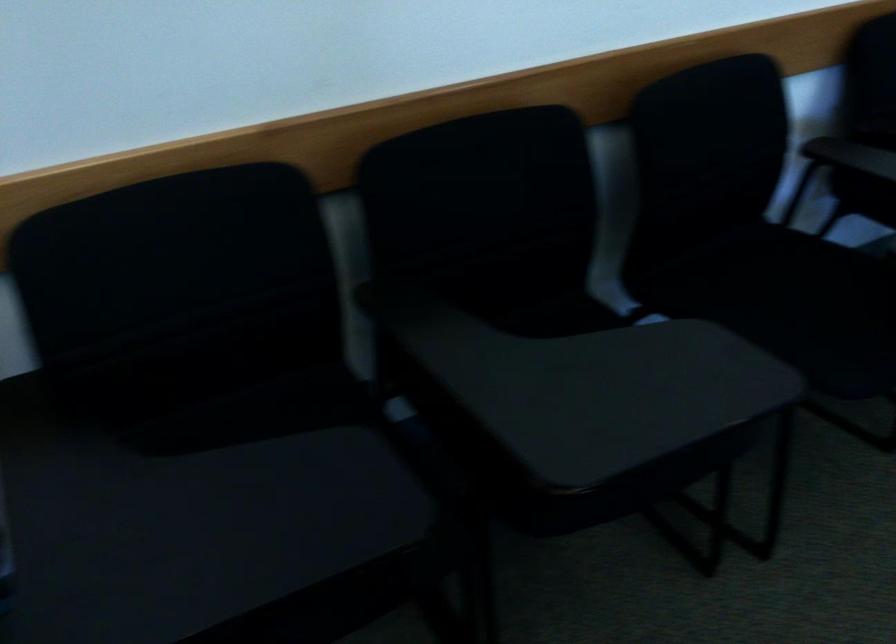
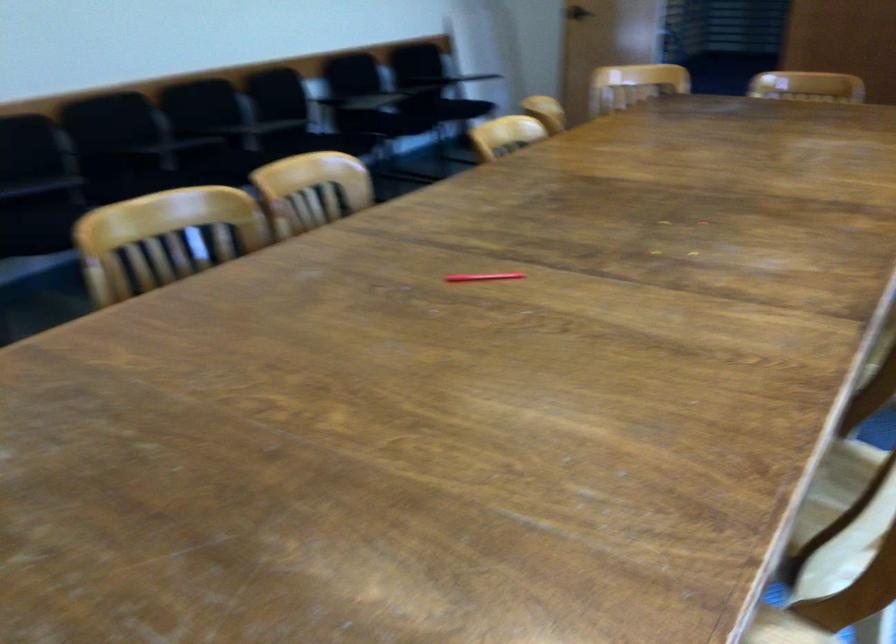
Locate, in the second image, the point that corresponds to point 804,333 in the first image.

(306, 138)